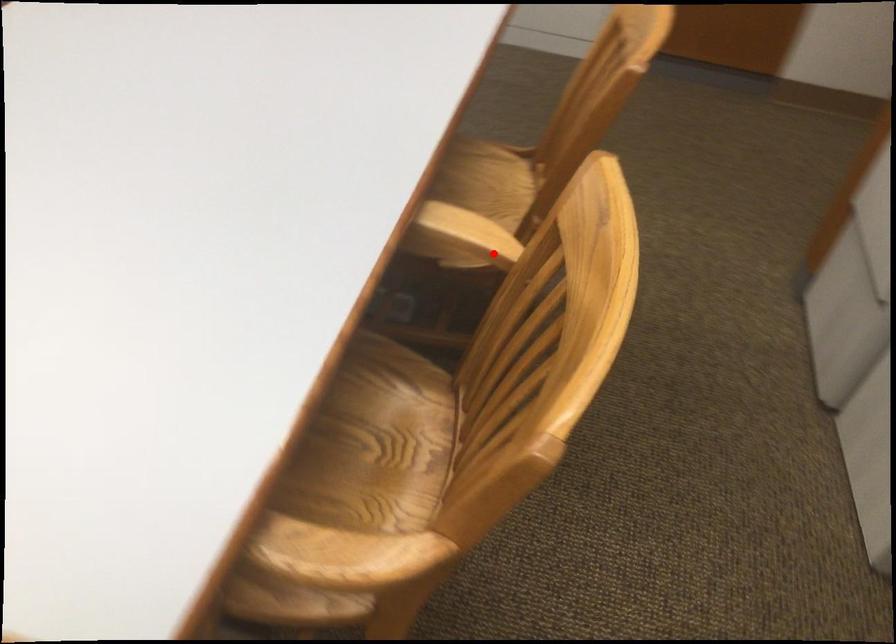
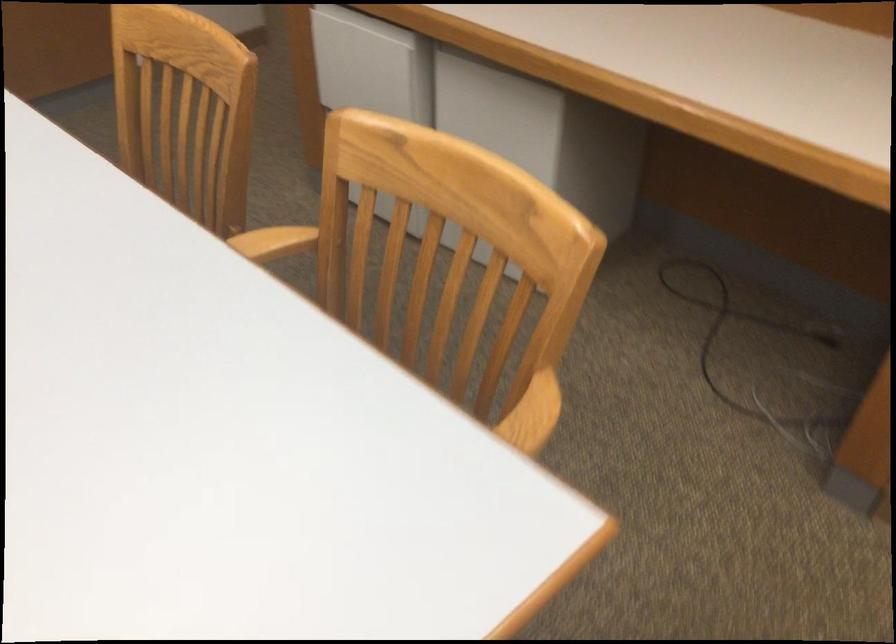
Question: A red point is marked in image1. In image2, is the corresponding 3D point closer to the camera or farther? Reply with the corresponding letter.

Choices:
 (A) The corresponding 3D point is closer.
 (B) The corresponding 3D point is farther.

Answer: (B)